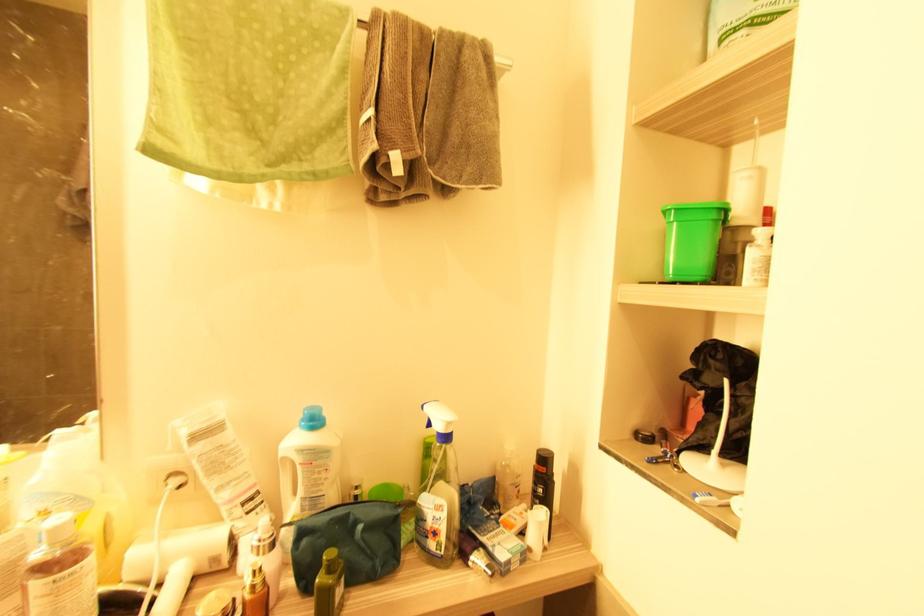
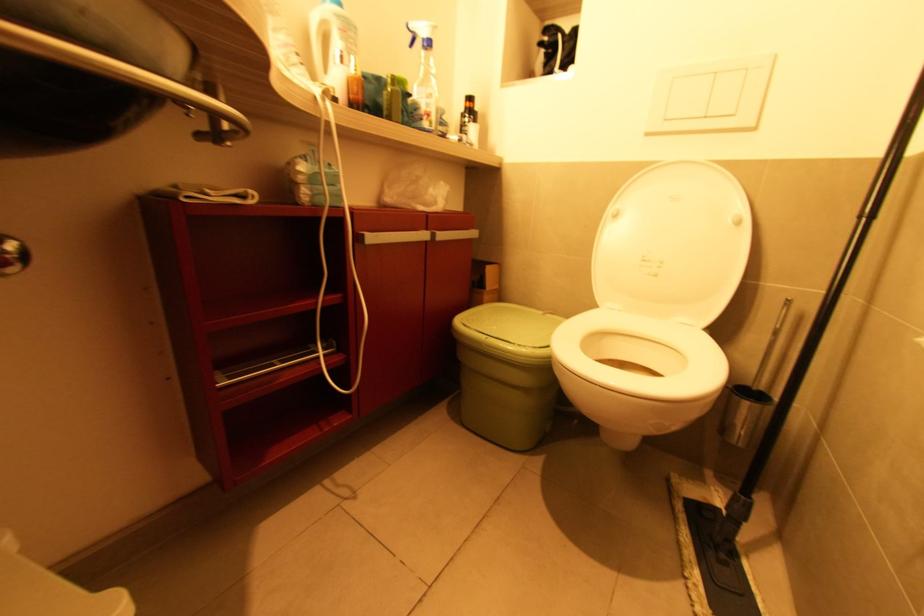
Question: I am providing you with two images of the same scene from different viewpoints. Which of the following objects are not visible in image2?

Choices:
 (A) white detergent bottle
 (B) white toilet seat
 (C) toilet brush handle
 (D) none of these

Answer: (D)